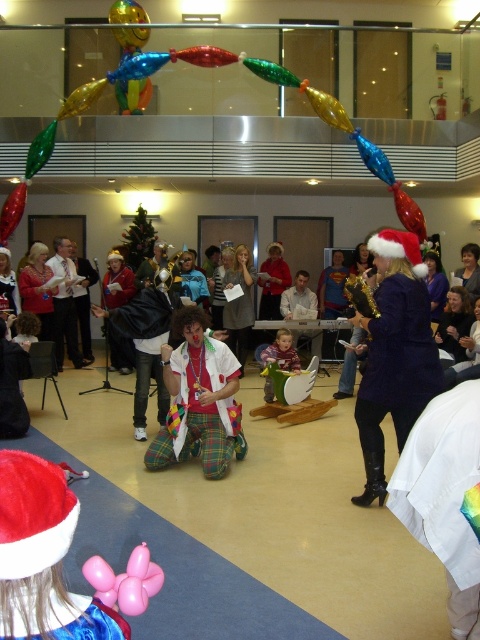
Question: Which of the following is the closest to the observer?

Choices:
 (A) purple fabric coat at center
 (B) red velvet santa hat at lower left

Answer: (B)

Question: Does purple fabric coat at center have a smaller size compared to matte green plush toy at center?

Choices:
 (A) no
 (B) yes

Answer: (A)

Question: Which of the following is the farthest from the observer?

Choices:
 (A) (211, 348)
 (B) (268, 392)
 (C) (36, 568)

Answer: (B)

Question: Can you confirm if pink rubber balloon at lower left is bigger than matte green plush toy at center?

Choices:
 (A) yes
 (B) no

Answer: (B)

Question: Is red velvet santa hat at lower left positioned at the back of matte green plush toy at center?

Choices:
 (A) no
 (B) yes

Answer: (A)

Question: Which object is positioned closest to the plaid fabric clown at center?

Choices:
 (A) matte green plush toy at center
 (B) purple fabric coat at center
 (C) pink rubber balloon at lower left
 (D) red velvet santa hat at lower left

Answer: (B)